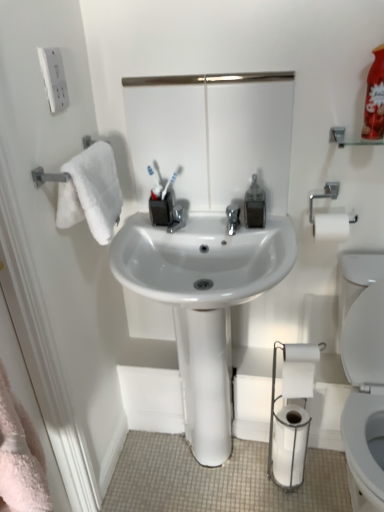
Question: From a real-world perspective, relative to white glossy sink at center, is white matte toilet paper at lower right, acting as the 1th toilet paper starting from the top, vertically above or below?

Choices:
 (A) above
 (B) below

Answer: (A)

Question: Based on their sizes in the image, would you say white matte toilet paper at lower right, acting as the 1th toilet paper starting from the top, is bigger or smaller than white glossy sink at center?

Choices:
 (A) small
 (B) big

Answer: (A)

Question: Which is nearer to the white matte toilet paper at lower right, the 2th toilet paper from the top?

Choices:
 (A) clear plastic soap dispenser at center
 (B) white plastic toothbrush at center
 (C) white glossy mirror at upper center
 (D) white matte toilet paper at lower right, the 2th toilet paper positioned from the bottom
 (E) white glossy sink at center

Answer: (D)

Question: Estimate the real-world distances between objects in this image. Which object is farther from the clear plastic soap dispenser at center?

Choices:
 (A) white glossy sink at center
 (B) white matte toilet paper at lower right, acting as the 1th toilet paper starting from the top
 (C) white plastic toothbrush at center
 (D) white matte toilet paper at lower right, the 1th toilet paper positioned from the bottom
 (E) white glossy mirror at upper center

Answer: (D)